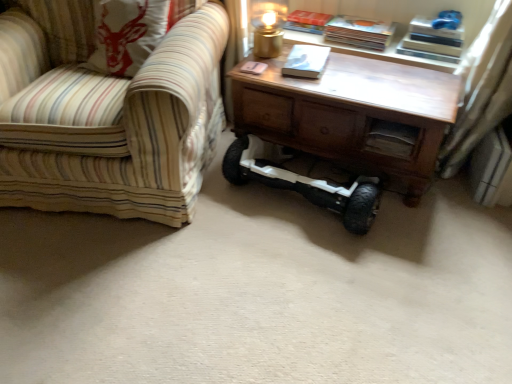
Locate an element on the screen. The image size is (512, 384). free spot in front of wooden table at center is located at coordinates (356, 274).